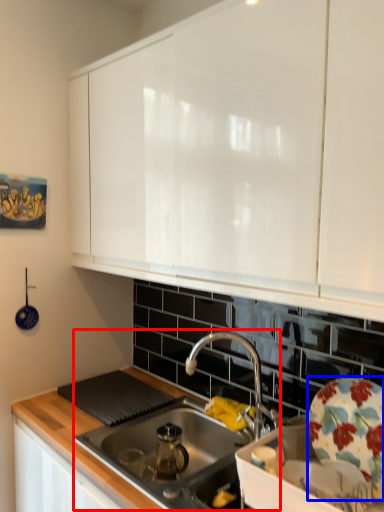
Question: Which object is further to the camera taking this photo, sink (highlighted by a red box) or plate (highlighted by a blue box)?

Choices:
 (A) sink
 (B) plate

Answer: (A)